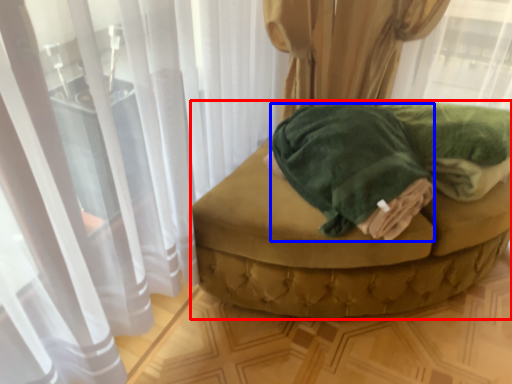
Question: Which object appears closest to the camera in this image, furniture (highlighted by a red box) or bath towel (highlighted by a blue box)?

Choices:
 (A) furniture
 (B) bath towel

Answer: (B)